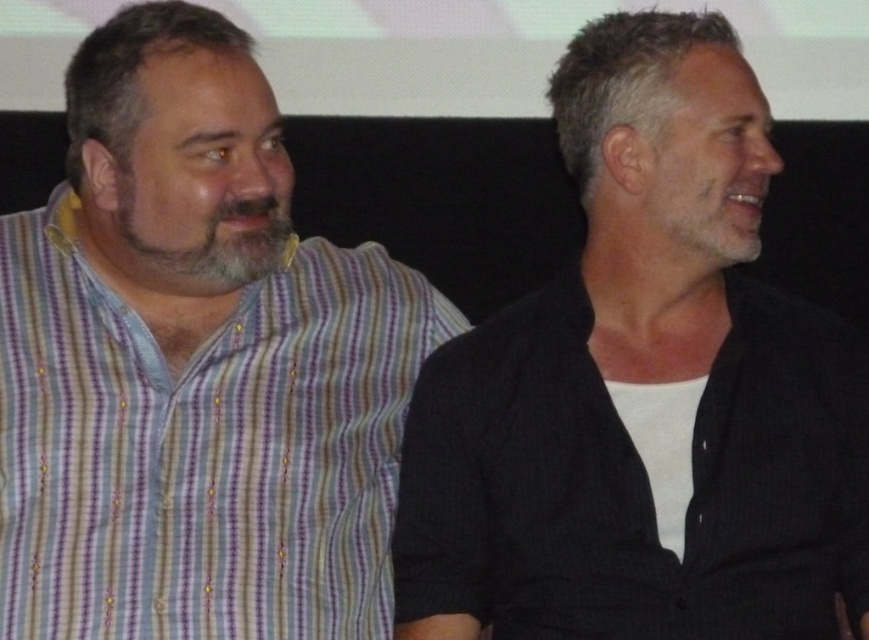
Does dark gray textured shirt at center have a lesser width compared to graywoollybeard at left?

No.

Is dark gray textured shirt at center shorter than graywoollybeard at left?

No, dark gray textured shirt at center is not shorter than graywoollybeard at left.

What do you see at coordinates (642, 390) in the screenshot? The image size is (869, 640). I see `dark gray textured shirt at center` at bounding box center [642, 390].

Locate an element on the screen. Image resolution: width=869 pixels, height=640 pixels. dark gray textured shirt at center is located at coordinates (642, 390).

Can you confirm if striped cotton shirt at left is smaller than graywoollybeard at left?

Incorrect, striped cotton shirt at left is not smaller in size than graywoollybeard at left.

Looking at this image, does striped cotton shirt at left appear under graywoollybeard at left?

Yes.

Identify the location of striped cotton shirt at left. Image resolution: width=869 pixels, height=640 pixels. (203, 445).

Between dark gray textured shirt at center and striped cotton shirt at left, which one is positioned lower?

striped cotton shirt at left is lower down.

Does dark gray textured shirt at center appear under striped cotton shirt at left?

No, dark gray textured shirt at center is not below striped cotton shirt at left.

Does point (745, 72) come behind point (40, 625)?

Yes, it is behind point (40, 625).

Locate an element on the screen. The image size is (869, 640). dark gray textured shirt at center is located at coordinates (642, 390).